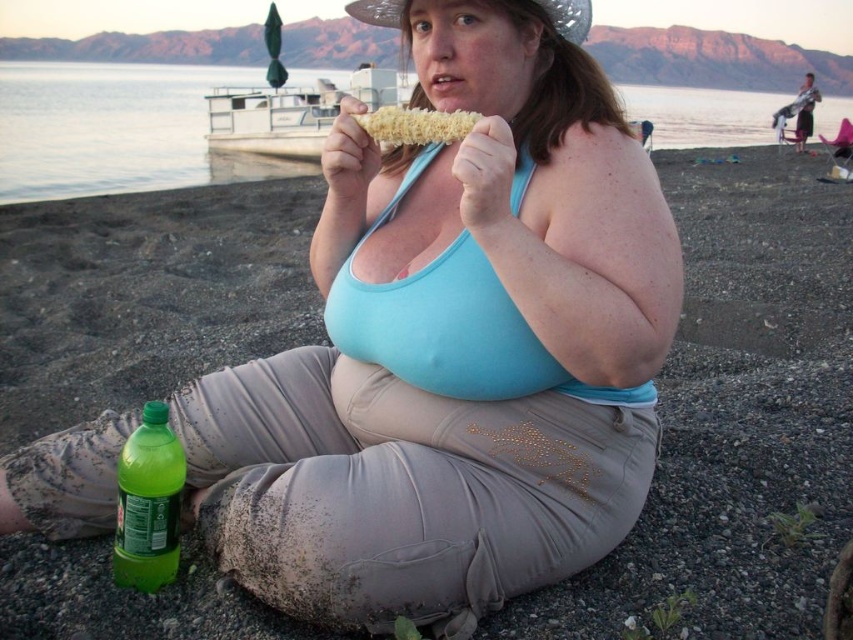
You are standing at the point closest to the boat dock. Which of the two points, point (128, 157) or point (125, 468), is farther away from you?

Point (128, 157) is behind point (125, 468), so if you are standing at the point closest to the boat dock, point (128, 157) is farther away from you.